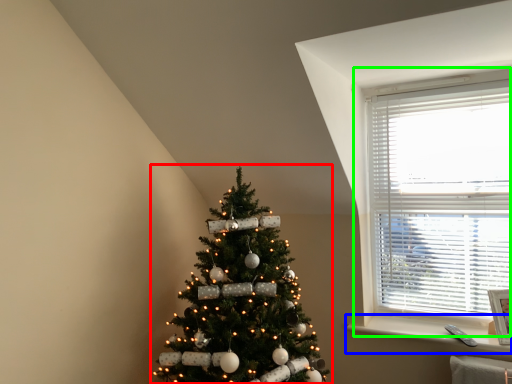
Question: Estimate the real-world distances between objects in this image. Which object is farther from christmas tree (highlighted by a red box), window sill (highlighted by a blue box) or window (highlighted by a green box)?

Choices:
 (A) window sill
 (B) window

Answer: (B)